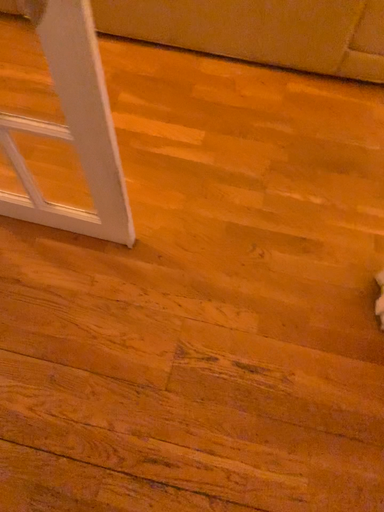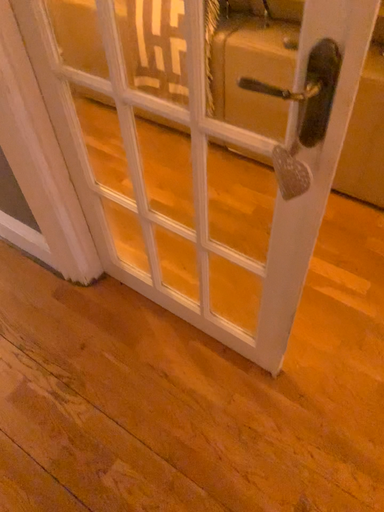
Question: How did the camera likely rotate when shooting the video?

Choices:
 (A) rotated upward
 (B) rotated downward

Answer: (A)